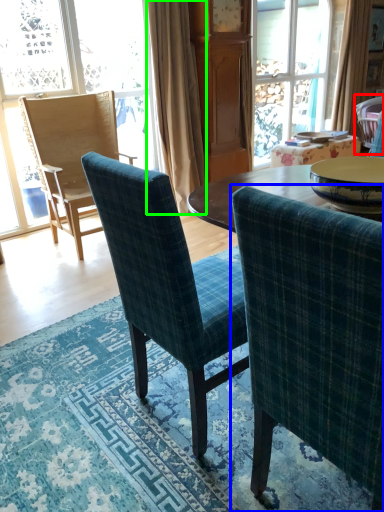
Question: Which is nearer to the chair (highlighted by a red box)? chair (highlighted by a blue box) or curtain (highlighted by a green box).

Choices:
 (A) chair
 (B) curtain

Answer: (B)